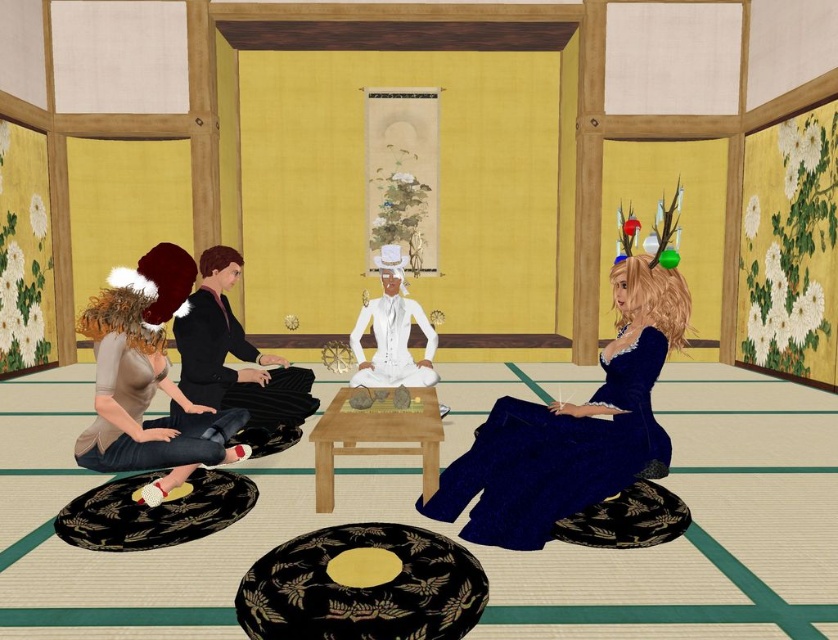
Question: Is matte brown hair at left to the left of matte black dress at center from the viewer's perspective?

Choices:
 (A) no
 (B) yes

Answer: (B)

Question: Estimate the real-world distances between objects in this image. Which object is farther from the white satin suit at center?

Choices:
 (A) matte black dress at center
 (B) matte brown hair at left

Answer: (B)

Question: Can you confirm if matte black dress at center is wider than white satin suit at center?

Choices:
 (A) yes
 (B) no

Answer: (B)

Question: Can you confirm if matte brown hair at left is thinner than matte black dress at center?

Choices:
 (A) yes
 (B) no

Answer: (B)

Question: Which of the following is the closest to the observer?

Choices:
 (A) (109, 292)
 (B) (215, 284)

Answer: (A)

Question: Which object is closer to the camera taking this photo?

Choices:
 (A) matte brown hair at left
 (B) matte black dress at center

Answer: (A)